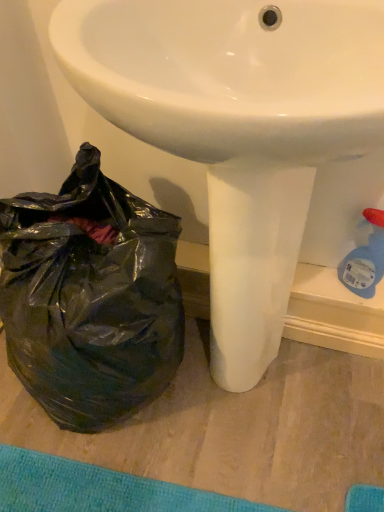
Question: Is point (251, 25) closer or farther from the camera than point (139, 283)?

Choices:
 (A) farther
 (B) closer

Answer: (B)

Question: Considering the positions of white glossy sink at center and black plastic bag at lower left in the image, is white glossy sink at center wider or thinner than black plastic bag at lower left?

Choices:
 (A) thin
 (B) wide

Answer: (B)

Question: In the image, is white glossy sink at center on the left side or the right side of black plastic bag at lower left?

Choices:
 (A) left
 (B) right

Answer: (B)

Question: Is black plastic bag at lower left in front of or behind white glossy sink at center in the image?

Choices:
 (A) behind
 (B) front

Answer: (A)

Question: Does point (91, 351) appear closer or farther from the camera than point (230, 337)?

Choices:
 (A) closer
 (B) farther

Answer: (A)

Question: From a real-world perspective, is black plastic bag at lower left positioned above or below white glossy sink at center?

Choices:
 (A) below
 (B) above

Answer: (A)

Question: From the image's perspective, relative to white glossy sink at center, is black plastic bag at lower left above or below?

Choices:
 (A) below
 (B) above

Answer: (A)